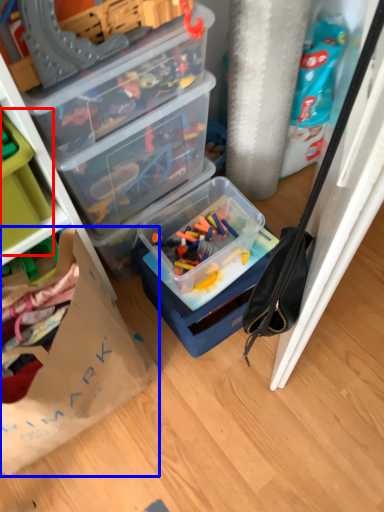
Question: Which object is closer to the camera taking this photo, storage box (highlighted by a red box) or paper bag (highlighted by a blue box)?

Choices:
 (A) storage box
 (B) paper bag

Answer: (B)